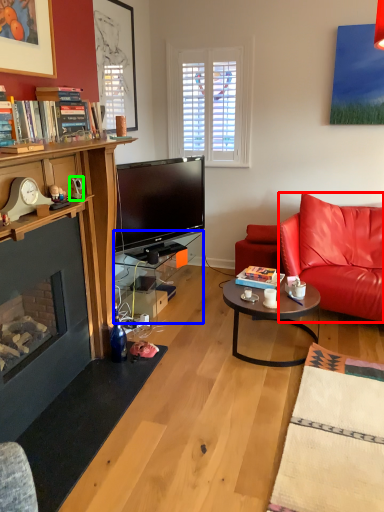
Question: Estimate the real-world distances between objects in this image. Which object is closer to cushion (highlighted by a red box), table (highlighted by a blue box) or corded phone (highlighted by a green box)?

Choices:
 (A) table
 (B) corded phone

Answer: (A)